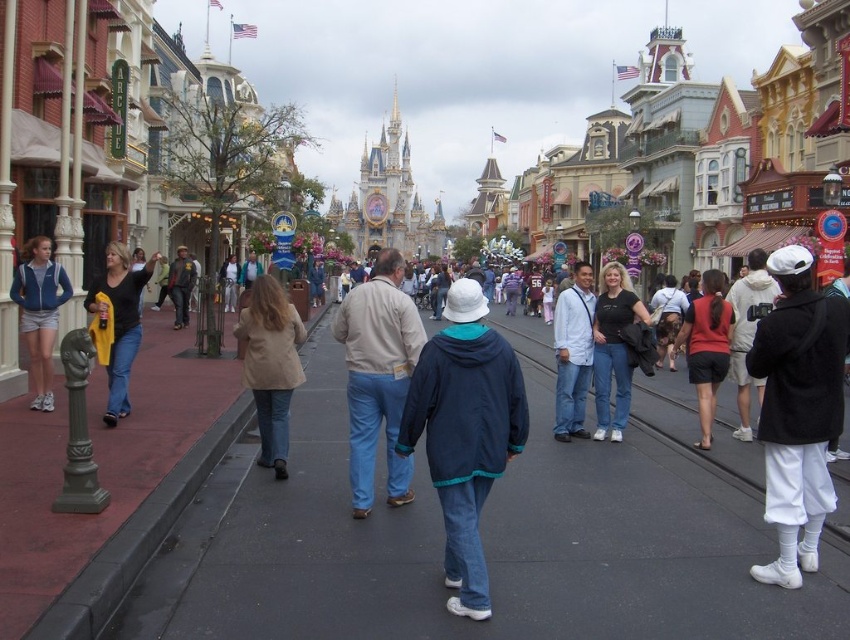
Is light brown cotton jacket at center taller than white cotton shirt at center?

Correct, light brown cotton jacket at center is much taller as white cotton shirt at center.

Does light brown cotton jacket at center have a smaller size compared to white cotton shirt at center?

No.

Between point (400, 356) and point (565, 333), which one is positioned behind?

The point (565, 333) is behind.

Locate an element on the screen. The width and height of the screenshot is (850, 640). light brown cotton jacket at center is located at coordinates (378, 376).

Does tan leather jacket at center have a greater width compared to matte blue jacket at left?

Yes, tan leather jacket at center is wider than matte blue jacket at left.

Measure the distance between point (279, 316) and camera.

The distance of point (279, 316) from camera is 65.72 meters.

Find the location of a particular element. tan leather jacket at center is located at coordinates (272, 364).

Locate an element on the screen. tan leather jacket at center is located at coordinates (272, 364).

Between matte black jacket at center and red fabric shorts at center, which one is positioned higher?

red fabric shorts at center

Based on the photo, which is more to the left, matte black jacket at center or red fabric shorts at center?

matte black jacket at center is more to the left.

Does point (605, 348) come in front of point (712, 396)?

No, (605, 348) is behind (712, 396).

The width and height of the screenshot is (850, 640). Identify the location of matte black jacket at center. (613, 348).